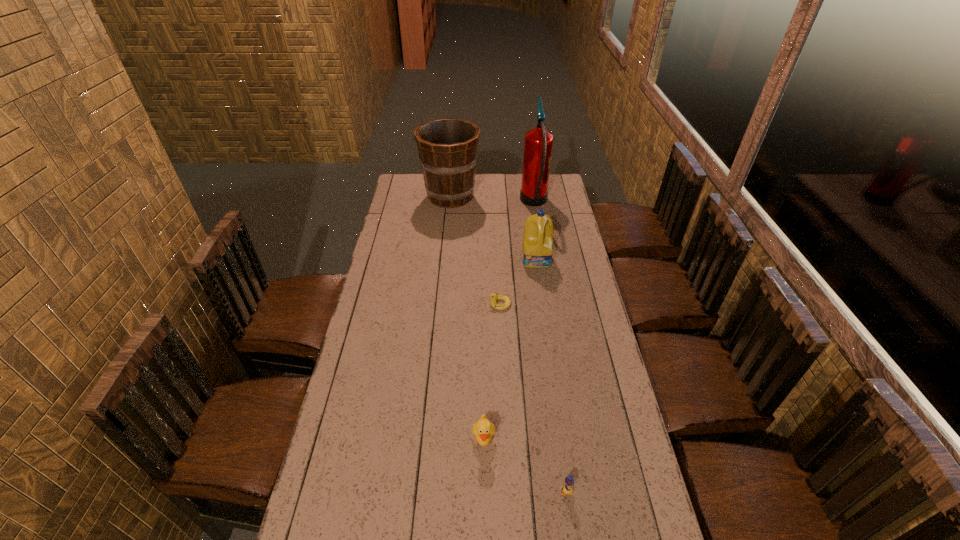
You are a GUI agent. You are given a task and a screenshot of the screen. Output one action in this format:
    pyautogui.click(x=<x>, y=<y>)
    Task: Click on the fire extinguisher located at the right edge
    The width and height of the screenshot is (960, 540).
    Given the screenshot: What is the action you would take?
    pyautogui.click(x=538, y=143)

Locate an element on the screen. detergent that is at the right edge is located at coordinates (537, 248).

At what (x,y) coordinates should I click in order to perform the action: click on object that is at the far left corner. Please return your answer as a coordinate pair (x, y). Looking at the image, I should click on [447, 147].

Locate an element on the screen. The image size is (960, 540). object that is at the far right corner is located at coordinates (538, 143).

I want to click on vacant space at the left edge of the desktop, so click(x=411, y=221).

At what (x,y) coordinates should I click in order to perform the action: click on vacant region at the right edge of the desktop. Please return your answer as a coordinate pair (x, y). Looking at the image, I should click on pyautogui.click(x=601, y=349).

Identify the location of blank space at the far left corner of the desktop. This screenshot has width=960, height=540. (400, 187).

Where is `blank region between the tallest duckling and the second tallest duckling`? blank region between the tallest duckling and the second tallest duckling is located at coordinates point(525,466).

Find the location of a particular element. The width and height of the screenshot is (960, 540). unoccupied position between the detergent and the second nearest duckling is located at coordinates (511, 349).

Locate an element on the screen. vacant point located between the rightmost duckling and the bucket is located at coordinates (508, 344).